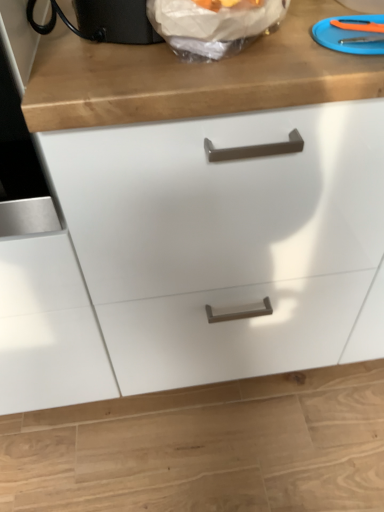
What are the coordinates of `free space in front of white paper bag at upper center` in the screenshot? It's located at (206, 80).